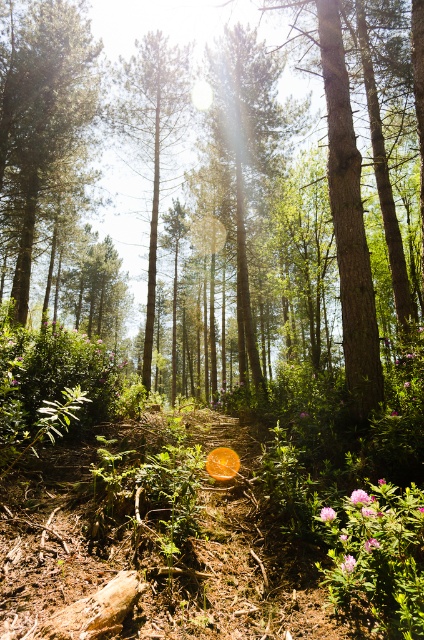
You are standing in the forest and see a point marked at coordinates (42, 125). According to the scene description, what object is located at that point?

The point at coordinates (42, 125) corresponds to the green matte tree at center.

You are a hiker lost in the forest and see two trees at the center of the image. Which tree would block your view of the other? Please choose between the green matte tree at center and the green leafy tree at center.

The green leafy tree at center is behind the green matte tree at center, so the green matte tree at center would block your view of the green leafy tree at center.